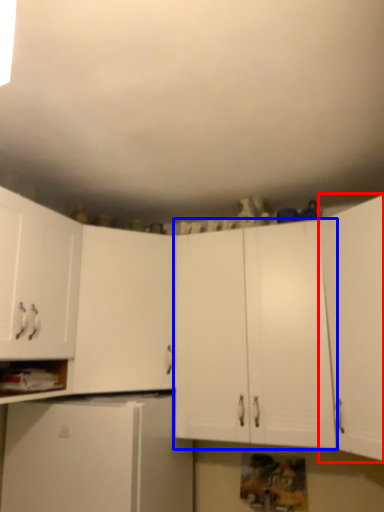
Question: Which point is closer to the camera, cabinetry (highlighted by a red box) or cabinetry (highlighted by a blue box)?

Choices:
 (A) cabinetry
 (B) cabinetry

Answer: (A)